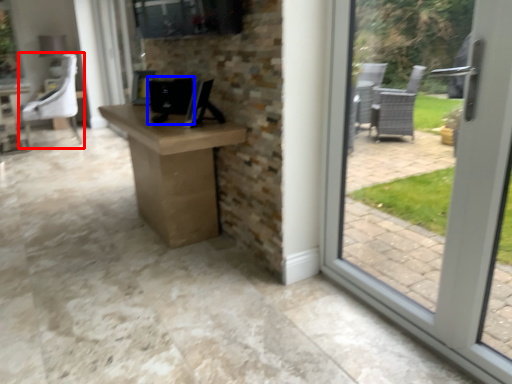
Question: Which object is closer to the camera taking this photo, chair (highlighted by a red box) or desktop computer (highlighted by a blue box)?

Choices:
 (A) chair
 (B) desktop computer

Answer: (B)